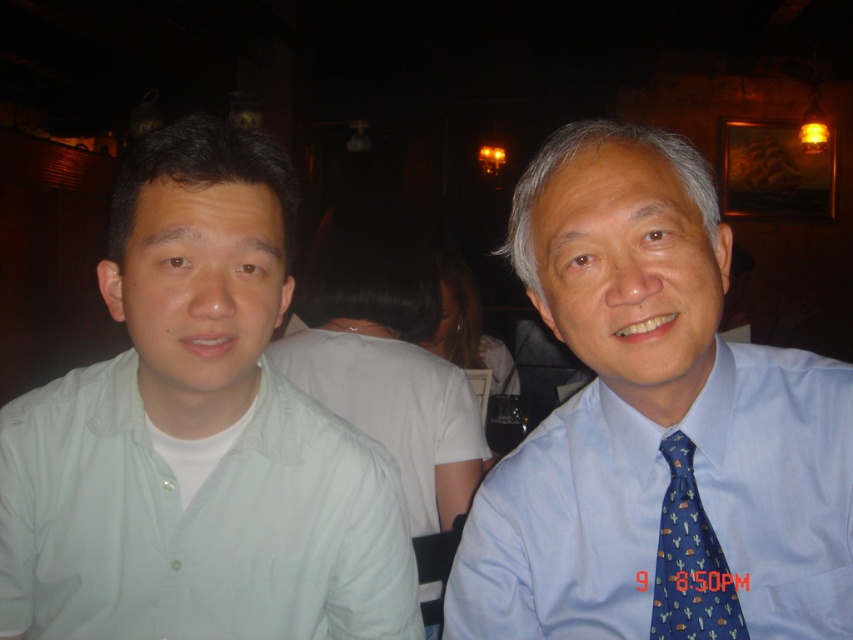
You are at a bar and want to order a drink. The bartender is wearing a light green cotton shirt at left. Where should you look to find the bartender?

The bartender is wearing the light green cotton shirt at left, which is located at point (x=196, y=435). You should look towards that coordinate to find the bartender.

You are a photographer adjusting the lighting in this dimly lit indoor scene. You notice the blue silk shirt at right and the blue silk tie at right. Which one should you focus on first to ensure proper exposure, considering their positions?

The blue silk shirt at right is in front of the blue silk tie at right, so you should focus on the blue silk shirt at right first to ensure proper exposure since it is closer to the camera.